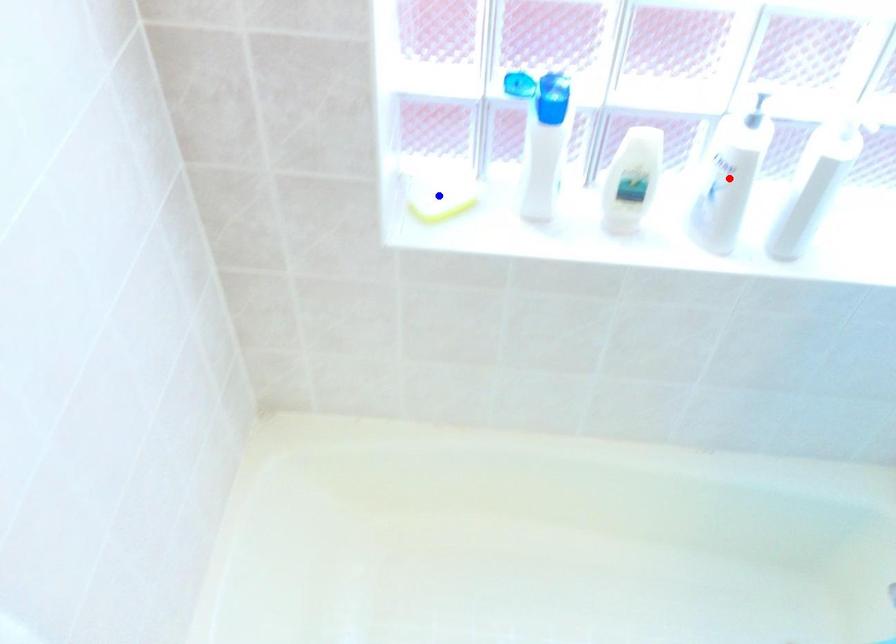
Question: Two points are marked on the image. Which point is closer to the camera?

Choices:
 (A) Blue point is closer.
 (B) Red point is closer.

Answer: (B)